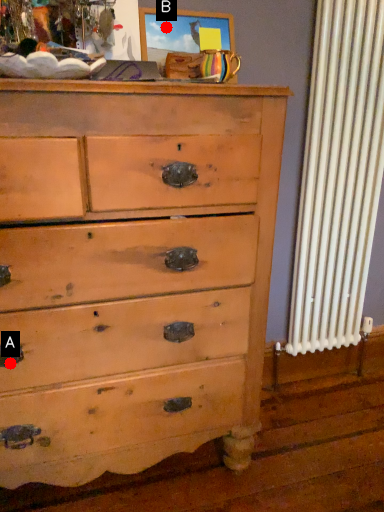
Question: Two points are circled on the image, labeled by A and B beside each circle. Which point is closer to the camera taking this photo?

Choices:
 (A) A is closer
 (B) B is closer

Answer: (A)